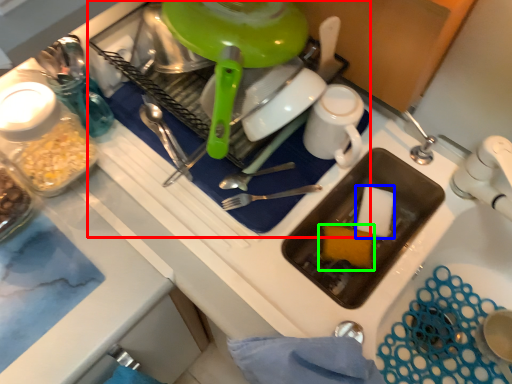
Question: Which object is the farthest from appliance (highlighted by a red box)? Choose among these: food (highlighted by a blue box) or food (highlighted by a green box).

Choices:
 (A) food
 (B) food

Answer: (A)